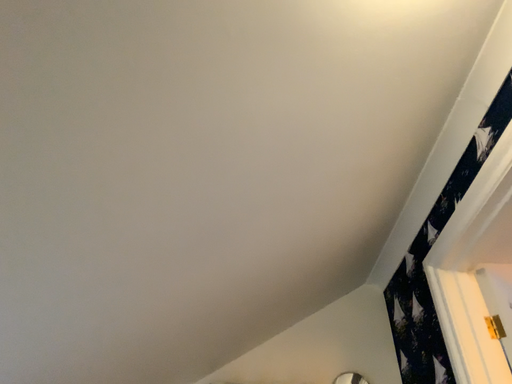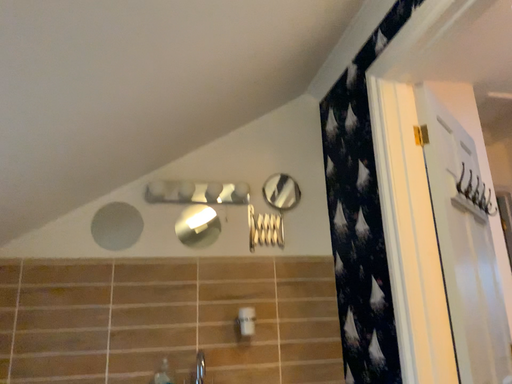
Question: How did the camera likely rotate when shooting the video?

Choices:
 (A) rotated upward
 (B) rotated downward

Answer: (B)